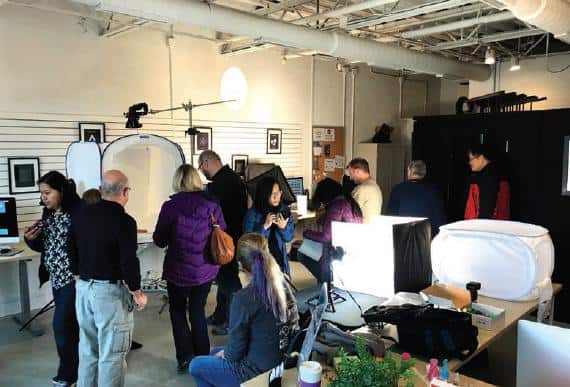
Locate an element on the screen. The width and height of the screenshot is (570, 387). desk is located at coordinates (24, 253), (293, 212), (515, 308).